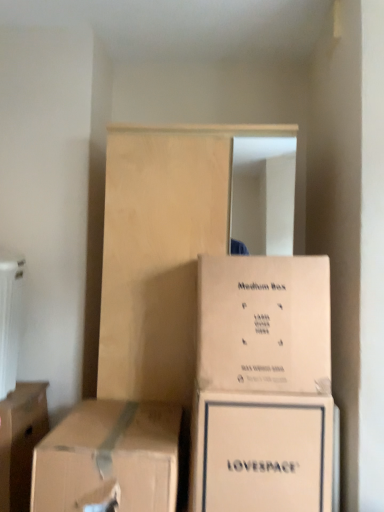
Where is `light wood dresser at center`? The width and height of the screenshot is (384, 512). light wood dresser at center is located at coordinates (181, 240).

Where is `white plastic radiator at left`? white plastic radiator at left is located at coordinates (10, 317).

What is the approximate width of brown cardboard box at lower left, arranged as the 3th box when viewed from the right?

brown cardboard box at lower left, arranged as the 3th box when viewed from the right, is 21.41 inches in width.

You are a GUI agent. You are given a task and a screenshot of the screen. Output one action in this format:
    pyautogui.click(x=<x>, y=<y>)
    Task: Click on the white cardboard box at lower center, placed as the third box when sorted from left to right
    The height and width of the screenshot is (512, 384).
    Given the screenshot: What is the action you would take?
    (261, 453)

Locate an element on the screen. The image size is (384, 512). beige cardboard box at center, acting as the first box starting from the right is located at coordinates (264, 324).

Considering the points (281, 336) and (0, 466), which point is behind, point (281, 336) or point (0, 466)?

Point (0, 466)

From a real-world perspective, who is located lower, beige cardboard box at center, arranged as the fourth box when viewed from the left, or brown cardboard box at lower left, the fourth box viewed from the right?

brown cardboard box at lower left, the fourth box viewed from the right, from a real-world perspective.

Which box is the 3rd one when counting from the left side of the beige cardboard box at center, arranged as the fourth box when viewed from the left? Please provide its 2D coordinates.

[(20, 441)]

Which is more to the left, beige cardboard box at center, acting as the first box starting from the right, or brown cardboard box at lower left, arranged as the first box when viewed from the left?

brown cardboard box at lower left, arranged as the first box when viewed from the left, is more to the left.

Can you confirm if white cardboard box at lower center, placed as the third box when sorted from left to right, is smaller than beige cardboard box at center, acting as the first box starting from the right?

Correct, white cardboard box at lower center, placed as the third box when sorted from left to right, occupies less space than beige cardboard box at center, acting as the first box starting from the right.

Considering the points (196, 401) and (267, 311), which point is behind, point (196, 401) or point (267, 311)?

The point (267, 311) is behind.

Is there a large distance between white cardboard box at lower center, arranged as the 2th box when viewed from the right, and beige cardboard box at center, arranged as the fourth box when viewed from the left?

white cardboard box at lower center, arranged as the 2th box when viewed from the right, is actually quite close to beige cardboard box at center, arranged as the fourth box when viewed from the left.

Measure the distance from white cardboard box at lower center, arranged as the 2th box when viewed from the right, to beige cardboard box at center, arranged as the fourth box when viewed from the left.

7.99 inches.

How many degrees apart are the facing directions of brown cardboard box at lower left, arranged as the 3th box when viewed from the right, and white cardboard box at lower center, arranged as the 2th box when viewed from the right?

There is a 1.51-degree angle between the facing directions of brown cardboard box at lower left, arranged as the 3th box when viewed from the right, and white cardboard box at lower center, arranged as the 2th box when viewed from the right.

Is brown cardboard box at lower left, acting as the 2th box starting from the left, positioned beyond the bounds of white cardboard box at lower center, placed as the third box when sorted from left to right?

Yes, brown cardboard box at lower left, acting as the 2th box starting from the left, is not within white cardboard box at lower center, placed as the third box when sorted from left to right.

From the brown cardboard box at lower left, arranged as the 3th box when viewed from the right, count 1st box to the right and point to it. Please provide its 2D coordinates.

[(261, 453)]

Considering their positions, is brown cardboard box at lower left, acting as the 2th box starting from the left, located in front of or behind white cardboard box at lower center, placed as the third box when sorted from left to right?

brown cardboard box at lower left, acting as the 2th box starting from the left, is positioned closer to the viewer than white cardboard box at lower center, placed as the third box when sorted from left to right.

Is brown cardboard box at lower left, arranged as the first box when viewed from the left, directly adjacent to white cardboard box at lower center, arranged as the 2th box when viewed from the right?

No, brown cardboard box at lower left, arranged as the first box when viewed from the left, is not in contact with white cardboard box at lower center, arranged as the 2th box when viewed from the right.

From the brown cardboard box at lower left, arranged as the first box when viewed from the left, count 2nd box to the right and point to it. Please provide its 2D coordinates.

[(261, 453)]

From a real-world perspective, is brown cardboard box at lower left, arranged as the first box when viewed from the left, below white cardboard box at lower center, placed as the third box when sorted from left to right?

Indeed, from a real-world perspective, brown cardboard box at lower left, arranged as the first box when viewed from the left, is positioned beneath white cardboard box at lower center, placed as the third box when sorted from left to right.

Can you confirm if brown cardboard box at lower left, arranged as the first box when viewed from the left, is thinner than white cardboard box at lower center, arranged as the 2th box when viewed from the right?

Indeed, brown cardboard box at lower left, arranged as the first box when viewed from the left, has a lesser width compared to white cardboard box at lower center, arranged as the 2th box when viewed from the right.

Identify the location of appliance behind the brown cardboard box at lower left, arranged as the first box when viewed from the left. This screenshot has height=512, width=384. (10, 317).

Considering the relative sizes of brown cardboard box at lower left, arranged as the first box when viewed from the left, and white plastic radiator at left in the image provided, is brown cardboard box at lower left, arranged as the first box when viewed from the left, thinner than white plastic radiator at left?

In fact, brown cardboard box at lower left, arranged as the first box when viewed from the left, might be wider than white plastic radiator at left.

What's the angular difference between brown cardboard box at lower left, the fourth box viewed from the right, and white plastic radiator at left's facing directions?

1.68 degrees.

From a real-world perspective, which is physically above, brown cardboard box at lower left, the fourth box viewed from the right, or white plastic radiator at left?

In real-world perspective, white plastic radiator at left is above.

From a real-world perspective, which is physically below, beige cardboard box at center, acting as the first box starting from the right, or light wood dresser at center?

From a 3D spatial view, light wood dresser at center is below.

From the image's perspective, which one is positioned lower, beige cardboard box at center, arranged as the fourth box when viewed from the left, or light wood dresser at center?

light wood dresser at center appears lower in the image.

Does beige cardboard box at center, acting as the first box starting from the right, have a greater height compared to light wood dresser at center?

No, beige cardboard box at center, acting as the first box starting from the right, is not taller than light wood dresser at center.

Relative to light wood dresser at center, is beige cardboard box at center, acting as the first box starting from the right, in front or behind?

beige cardboard box at center, acting as the first box starting from the right, is in front of light wood dresser at center.

From the image's perspective, between white plastic radiator at left and light wood dresser at center, who is located below?

From the image's view, light wood dresser at center is below.

Considering the positions of points (8, 320) and (110, 246), is point (8, 320) closer to camera compared to point (110, 246)?

No, it is not.

Looking at this image, in the image, is white plastic radiator at left positioned in front of or behind light wood dresser at center?

white plastic radiator at left is in front of light wood dresser at center.

Locate an element on the screen. Image resolution: width=384 pixels, height=512 pixels. box that is the 3rd object directly below the beige cardboard box at center, arranged as the fourth box when viewed from the left (from a real-world perspective) is located at coordinates (20, 441).

The width and height of the screenshot is (384, 512). In order to click on box located on the right of white cardboard box at lower center, placed as the third box when sorted from left to right in this screenshot , I will do `click(264, 324)`.

Based on their spatial positions, is beige cardboard box at center, arranged as the fourth box when viewed from the left, or brown cardboard box at lower left, the fourth box viewed from the right, closer to white plastic radiator at left?

Based on the image, brown cardboard box at lower left, the fourth box viewed from the right, appears to be nearer to white plastic radiator at left.

Consider the image. Looking at the image, which one is located further to white plastic radiator at left, brown cardboard box at lower left, arranged as the first box when viewed from the left, or light wood dresser at center?

light wood dresser at center is positioned further to the anchor white plastic radiator at left.

Looking at the image, which one is located further to white plastic radiator at left, white cardboard box at lower center, arranged as the 2th box when viewed from the right, or beige cardboard box at center, acting as the first box starting from the right?

The object further to white plastic radiator at left is white cardboard box at lower center, arranged as the 2th box when viewed from the right.

Looking at the image, which one is located further to white cardboard box at lower center, placed as the third box when sorted from left to right, white plastic radiator at left or brown cardboard box at lower left, acting as the 2th box starting from the left?

white plastic radiator at left lies further to white cardboard box at lower center, placed as the third box when sorted from left to right, than the other object.

Estimate the real-world distances between objects in this image. Which object is further from beige cardboard box at center, arranged as the fourth box when viewed from the left, brown cardboard box at lower left, arranged as the 3th box when viewed from the right, or light wood dresser at center?

Based on the image, brown cardboard box at lower left, arranged as the 3th box when viewed from the right, appears to be further to beige cardboard box at center, arranged as the fourth box when viewed from the left.

Which object lies further to the anchor point light wood dresser at center, brown cardboard box at lower left, the fourth box viewed from the right, or beige cardboard box at center, arranged as the fourth box when viewed from the left?

Among the two, brown cardboard box at lower left, the fourth box viewed from the right, is located further to light wood dresser at center.

Estimate the real-world distances between objects in this image. Which object is closer to beige cardboard box at center, arranged as the fourth box when viewed from the left, white cardboard box at lower center, arranged as the 2th box when viewed from the right, or brown cardboard box at lower left, arranged as the first box when viewed from the left?

white cardboard box at lower center, arranged as the 2th box when viewed from the right, is closer to beige cardboard box at center, arranged as the fourth box when viewed from the left.

Considering their positions, is white plastic radiator at left positioned closer to brown cardboard box at lower left, arranged as the first box when viewed from the left, than beige cardboard box at center, acting as the first box starting from the right?

Based on the image, white plastic radiator at left appears to be nearer to brown cardboard box at lower left, arranged as the first box when viewed from the left.

Locate an element on the screen. dresser located between brown cardboard box at lower left, the fourth box viewed from the right, and beige cardboard box at center, acting as the first box starting from the right, in the left-right direction is located at coordinates (x=181, y=240).

At what (x,y) coordinates should I click in order to perform the action: click on dresser located between brown cardboard box at lower left, the fourth box viewed from the right, and white cardboard box at lower center, placed as the third box when sorted from left to right, in the left-right direction. Please return your answer as a coordinate pair (x, y). Looking at the image, I should click on (181, 240).

Where is `box between brown cardboard box at lower left, the fourth box viewed from the right, and light wood dresser at center, in the horizontal direction`? This screenshot has height=512, width=384. box between brown cardboard box at lower left, the fourth box viewed from the right, and light wood dresser at center, in the horizontal direction is located at coordinates (109, 458).

You are a GUI agent. You are given a task and a screenshot of the screen. Output one action in this format:
    pyautogui.click(x=<x>, y=<y>)
    Task: Click on the dresser located between white plastic radiator at left and beige cardboard box at center, arranged as the fourth box when viewed from the left, in the left-right direction
    This screenshot has height=512, width=384.
    Given the screenshot: What is the action you would take?
    pyautogui.click(x=181, y=240)